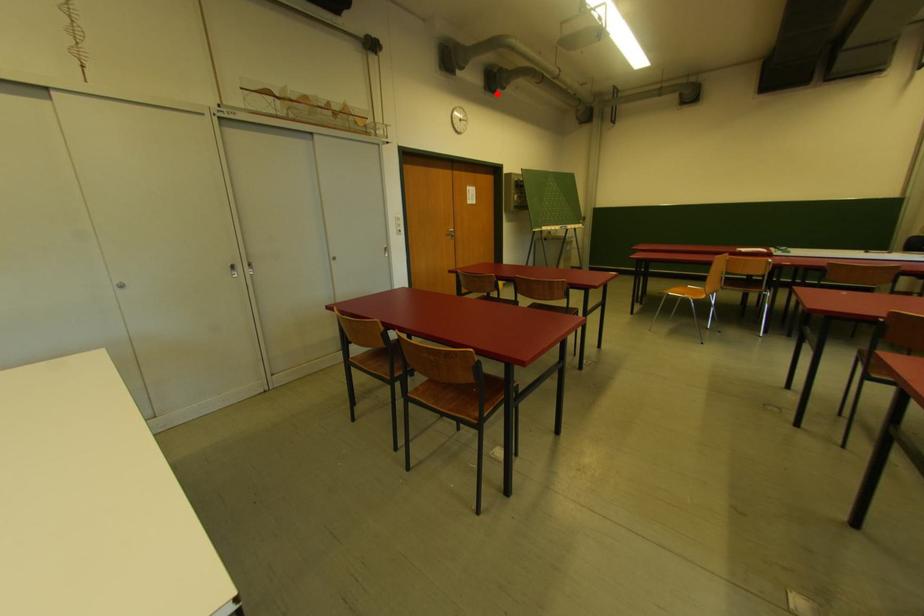
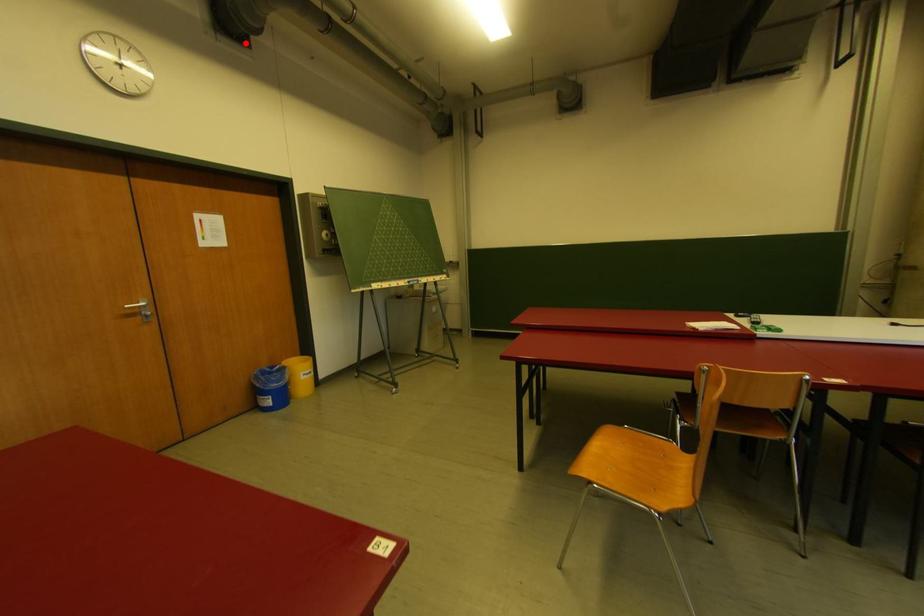
I am providing you with two images of the same scene from different viewpoints. A red point is marked on the first image and another point is marked on the second image. Does the point marked in image1 correspond to the same location as the one in image2?

Yes